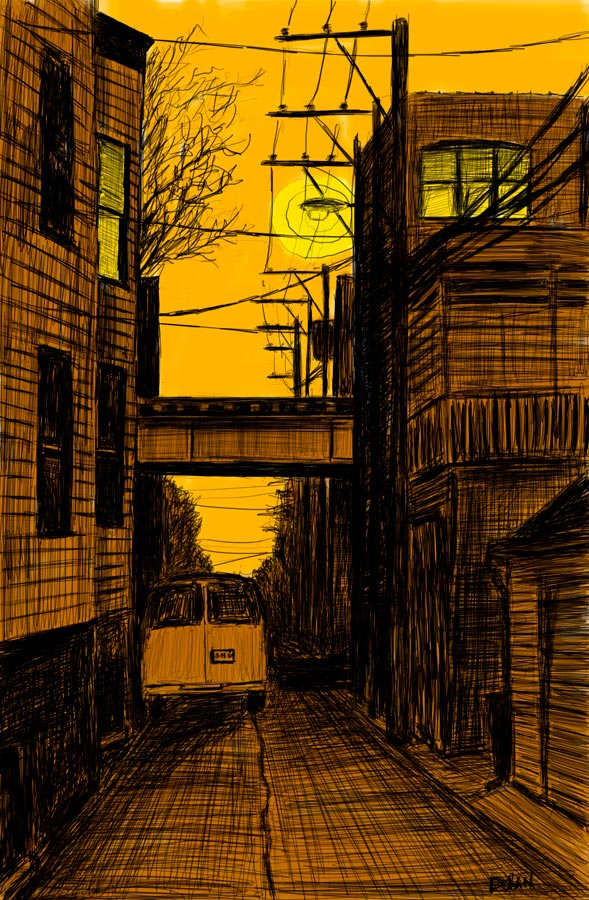
I want to click on windows with no light, so click(64, 481), click(102, 481), click(68, 199).